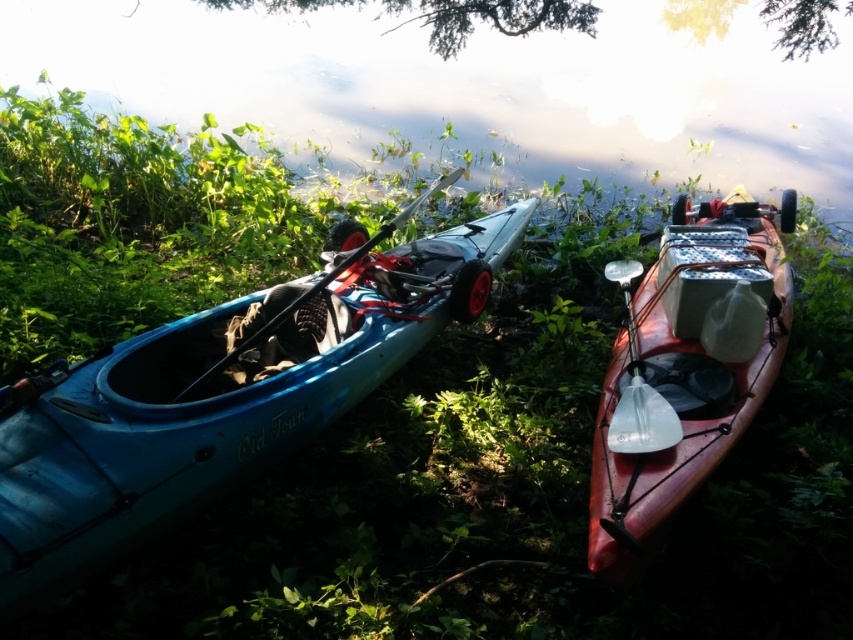
Question: In this image, where is blue plastic kayak at left located relative to green leafy tree at upper center?

Choices:
 (A) left
 (B) right

Answer: (A)

Question: Which is nearer to the green leafy tree at upper center?

Choices:
 (A) silver metallic paddle at center
 (B) matte red kayak at center
 (C) blue plastic kayak at left
 (D) matte black paddle at center

Answer: (B)

Question: Among these points, which one is farthest from the camera?

Choices:
 (A) (822, 17)
 (B) (227, 332)

Answer: (A)

Question: Observing the image, what is the correct spatial positioning of blue plastic kayak at left in reference to matte black paddle at center?

Choices:
 (A) left
 (B) right

Answer: (B)

Question: Which of the following is the farthest from the observer?

Choices:
 (A) green leafy tree at upper center
 (B) silver metallic paddle at center

Answer: (A)

Question: Does blue plastic kayak at left appear under matte red kayak at center?

Choices:
 (A) yes
 (B) no

Answer: (B)